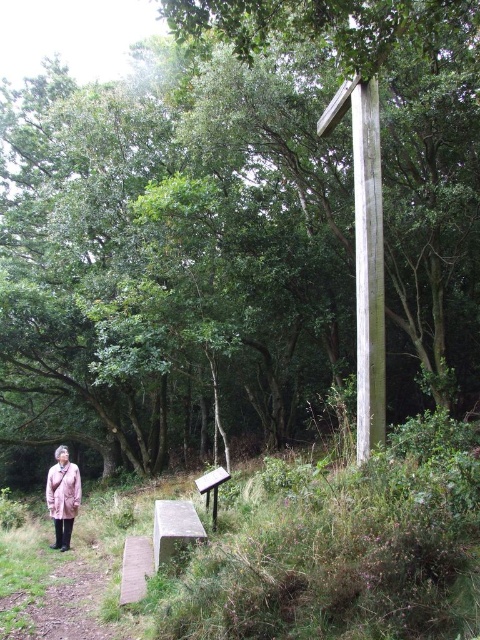
Is weathered wood pole at right wider than white stone bench at lower center?

In fact, weathered wood pole at right might be narrower than white stone bench at lower center.

Can you confirm if weathered wood pole at right is positioned below white stone bench at lower center?

No.

Measure the distance between weathered wood pole at right and camera.

weathered wood pole at right and camera are 5.14 meters apart from each other.

Locate an element on the screen. This screenshot has height=640, width=480. weathered wood pole at right is located at coordinates (368, 268).

Who is positioned more to the right, weathered wood pole at right or brown wooden bench at lower center?

weathered wood pole at right is more to the right.

Which is above, weathered wood pole at right or brown wooden bench at lower center?

weathered wood pole at right is higher up.

Describe the element at coordinates (368, 268) in the screenshot. I see `weathered wood pole at right` at that location.

Locate an element on the screen. The height and width of the screenshot is (640, 480). weathered wood pole at right is located at coordinates (368, 268).

Is white stone bench at lower center to the right of light brown textured jacket at lower left from the viewer's perspective?

Yes, white stone bench at lower center is to the right of light brown textured jacket at lower left.

Is white stone bench at lower center wider than light brown textured jacket at lower left?

Yes.

Is point (179, 513) closer to camera compared to point (60, 481)?

Yes, it is in front of point (60, 481).

The height and width of the screenshot is (640, 480). Find the location of `white stone bench at lower center`. white stone bench at lower center is located at coordinates (173, 529).